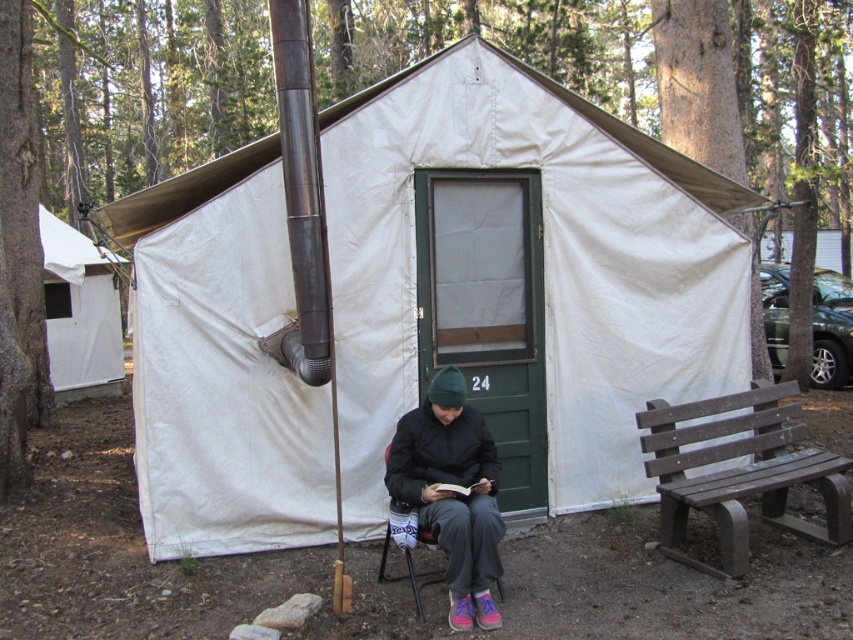
Does point (231, 285) lie in front of point (428, 580)?

No, (231, 285) is behind (428, 580).

In the scene shown: Is white canvas tent at center further to camera compared to metallic gray chair at center?

That is True.

In order to click on white canvas tent at center in this screenshot , I will do `click(527, 275)`.

How much distance is there between brown plastic bench at right and metallic gray chair at center?

brown plastic bench at right is 1.89 meters away from metallic gray chair at center.

The image size is (853, 640). What do you see at coordinates (740, 472) in the screenshot?
I see `brown plastic bench at right` at bounding box center [740, 472].

Locate an element on the screen. brown plastic bench at right is located at coordinates (740, 472).

The width and height of the screenshot is (853, 640). What are the coordinates of `white canvas tent at center` in the screenshot? It's located at (527, 275).

Is point (183, 205) positioned before point (729, 502)?

That is False.

Where is `white canvas tent at center`? The image size is (853, 640). white canvas tent at center is located at coordinates (527, 275).